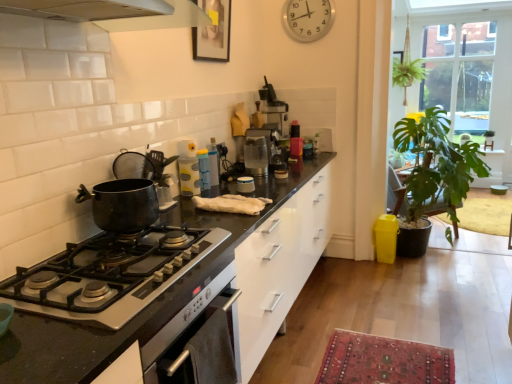
Question: From a real-world perspective, is clear glass coffee machine at center physically above green leafy plant at right?

Choices:
 (A) yes
 (B) no

Answer: (A)

Question: Is green leafy plant at right completely or partially inside clear glass coffee machine at center?

Choices:
 (A) no
 (B) yes

Answer: (A)

Question: From the image's perspective, does clear glass coffee machine at center appear higher than green leafy plant at right?

Choices:
 (A) no
 (B) yes

Answer: (B)

Question: Is clear glass coffee machine at center thinner than green leafy plant at right?

Choices:
 (A) yes
 (B) no

Answer: (A)

Question: Is clear glass coffee machine at center to the left of green leafy plant at right from the viewer's perspective?

Choices:
 (A) no
 (B) yes

Answer: (B)

Question: From the image's perspective, is wooden picture frame at upper center positioned above or below clear glass window at upper right?

Choices:
 (A) below
 (B) above

Answer: (A)

Question: Looking at the image, does wooden picture frame at upper center seem bigger or smaller compared to clear glass window at upper right?

Choices:
 (A) big
 (B) small

Answer: (B)

Question: Visually, is wooden picture frame at upper center positioned to the left or to the right of clear glass window at upper right?

Choices:
 (A) right
 (B) left

Answer: (B)

Question: Relative to clear glass window at upper right, is wooden picture frame at upper center in front or behind?

Choices:
 (A) behind
 (B) front

Answer: (B)

Question: In terms of width, does silver metallic clock at upper center look wider or thinner when compared to wooden picture frame at upper center?

Choices:
 (A) thin
 (B) wide

Answer: (A)

Question: In terms of height, does silver metallic clock at upper center look taller or shorter compared to wooden picture frame at upper center?

Choices:
 (A) tall
 (B) short

Answer: (B)

Question: Which is correct: silver metallic clock at upper center is inside wooden picture frame at upper center, or outside of it?

Choices:
 (A) inside
 (B) outside

Answer: (B)

Question: Would you say silver metallic clock at upper center is to the left or to the right of wooden picture frame at upper center in the picture?

Choices:
 (A) left
 (B) right

Answer: (B)

Question: From the image's perspective, is silver metallic clock at upper center positioned above or below clear glass coffee machine at center?

Choices:
 (A) above
 (B) below

Answer: (A)

Question: From a real-world perspective, is silver metallic clock at upper center positioned above or below clear glass coffee machine at center?

Choices:
 (A) below
 (B) above

Answer: (B)